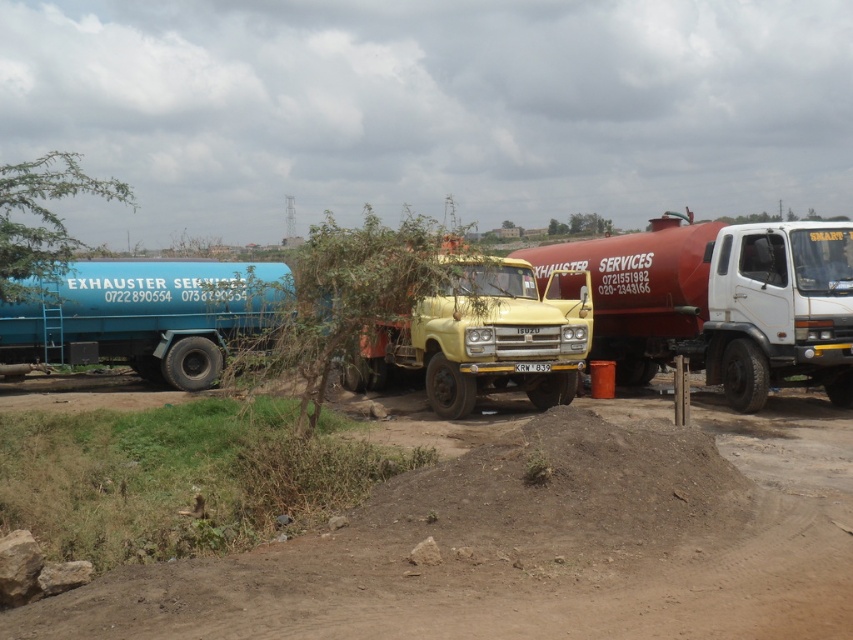
Which is behind, point (442, 564) or point (347, 282)?

The point (347, 282) is more distant.

Is brown dirt track at lower center taller than green leafy tree at center?

In fact, brown dirt track at lower center may be shorter than green leafy tree at center.

This screenshot has width=853, height=640. I want to click on brown dirt track at lower center, so click(537, 541).

Find the location of `brown dirt track at lower center`. brown dirt track at lower center is located at coordinates (537, 541).

Who is taller, yellow matte truck at center or green leafy tree at center?

green leafy tree at center

Locate an element on the screen. Image resolution: width=853 pixels, height=640 pixels. yellow matte truck at center is located at coordinates (482, 336).

What do you see at coordinates (537, 541) in the screenshot?
I see `brown dirt track at lower center` at bounding box center [537, 541].

Find the location of a particular element. This screenshot has height=640, width=853. brown dirt track at lower center is located at coordinates (537, 541).

Find the location of `brown dirt track at lower center`. brown dirt track at lower center is located at coordinates (537, 541).